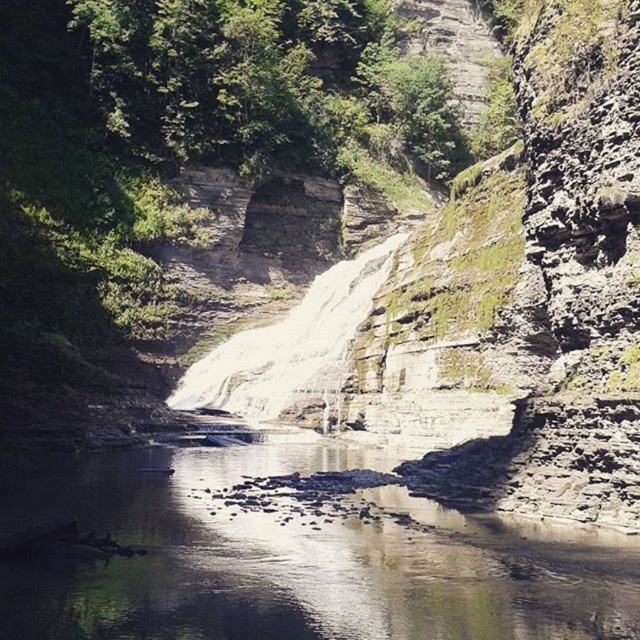
Question: Is clear water at center to the left of white smooth waterfall at center from the viewer's perspective?

Choices:
 (A) yes
 (B) no

Answer: (A)

Question: Which point appears closest to the camera in this image?

Choices:
 (A) (352, 284)
 (B) (557, 596)

Answer: (B)

Question: Is clear water at center bigger than white smooth waterfall at center?

Choices:
 (A) yes
 (B) no

Answer: (B)

Question: Among these points, which one is farthest from the camera?

Choices:
 (A) (353, 572)
 (B) (248, 330)

Answer: (B)

Question: Is clear water at center below white smooth waterfall at center?

Choices:
 (A) no
 (B) yes

Answer: (B)